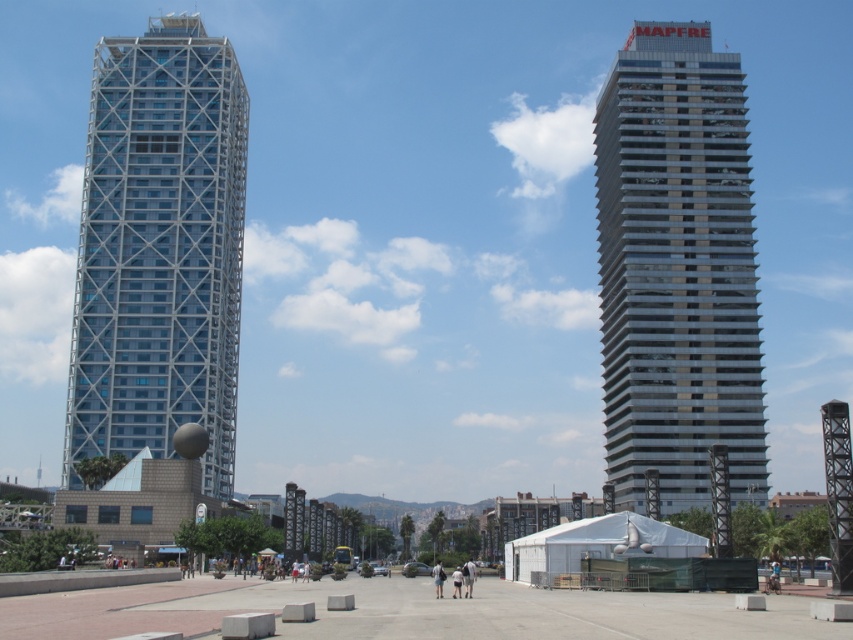
Question: Which object is closer to the camera taking this photo?

Choices:
 (A) translucent glass skyscraper at left
 (B) glassy silver skyscraper at right

Answer: (B)

Question: Which object appears farthest from the camera in this image?

Choices:
 (A) translucent glass skyscraper at left
 (B) glassy silver skyscraper at right

Answer: (A)

Question: Is glassy silver skyscraper at right positioned behind translucent glass skyscraper at left?

Choices:
 (A) no
 (B) yes

Answer: (A)

Question: Can you confirm if glassy silver skyscraper at right is thinner than translucent glass skyscraper at left?

Choices:
 (A) yes
 (B) no

Answer: (A)

Question: Does glassy silver skyscraper at right have a greater width compared to translucent glass skyscraper at left?

Choices:
 (A) yes
 (B) no

Answer: (B)